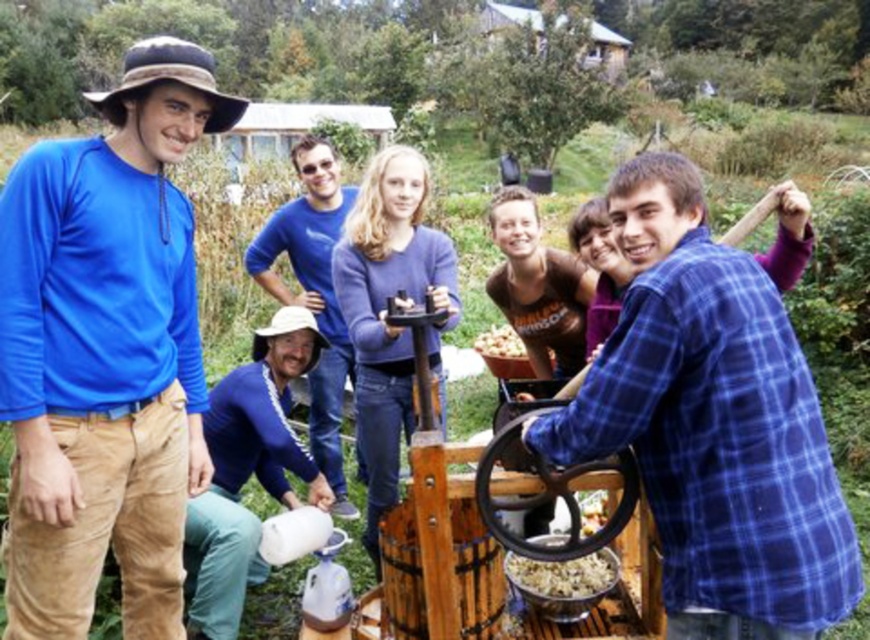
Based on the photo, you are a photographer trying to capture a group photo of the scene. You want to ensure that the blue cotton shirt at left and the crumbly brown food at center are both clearly visible in the frame. Given their height difference, which object might require you to adjust your camera angle to avoid being obscured?

The crumbly brown food at center is shorter than the blue cotton shirt at left, so you might need to lower your camera angle to ensure it is not hidden behind the taller blue cotton shirt at left.

You are organizing a group photo and need to ensure that the blue plaid shirt at center and the smooth brown nuts at center are both visible in the frame. Which object should you prioritize placing closer to the camera to ensure visibility?

The blue plaid shirt at center is bigger than smooth brown nuts at center, so you should prioritize placing the blue plaid shirt at center closer to the camera to ensure visibility.

You are a photographer trying to capture a group photo of the blue plaid shirt at center and the blue cotton shirt at center. Which person should you position closer to the camera to ensure both are in focus?

The blue plaid shirt at center is shorter than the blue cotton shirt at center, so positioning the blue plaid shirt at center closer to the camera will help keep both in focus.